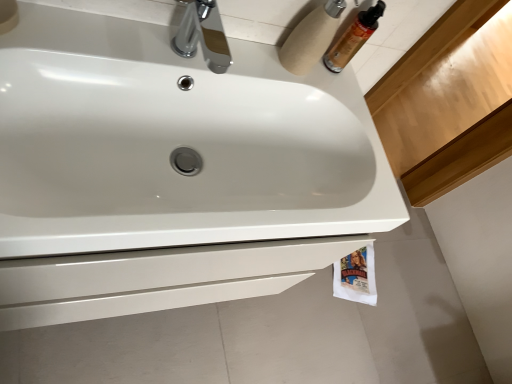
Locate an element on the screen. This screenshot has width=512, height=384. free point in front of white cardboard toilet paper at upper right, arranged as the 1th toilet paper when viewed from the front is located at coordinates (261, 63).